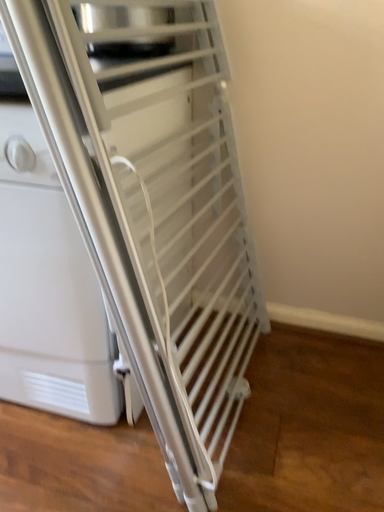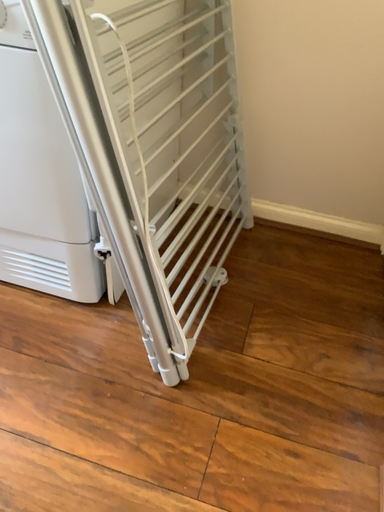
Question: Which way did the camera rotate in the video?

Choices:
 (A) rotated upward
 (B) rotated downward

Answer: (B)